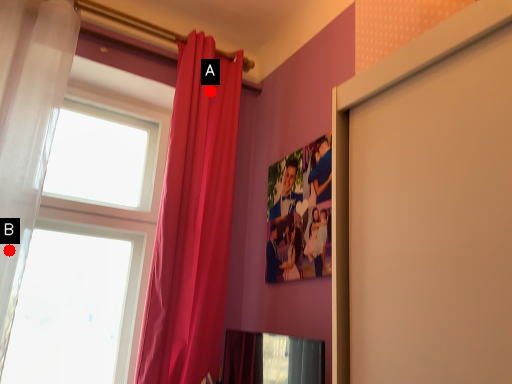
Question: Two points are circled on the image, labeled by A and B beside each circle. Among these points, which one is nearest to the camera?

Choices:
 (A) A is closer
 (B) B is closer

Answer: (B)